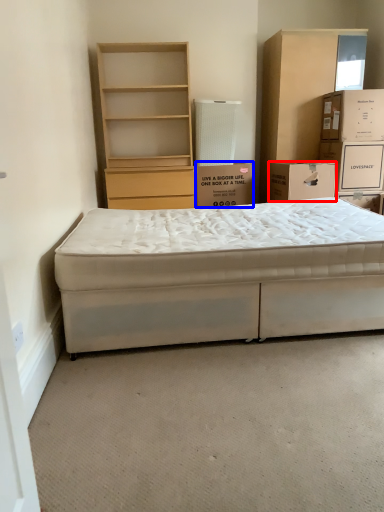
Question: Among these objects, which one is farthest to the camera, box (highlighted by a red box) or box (highlighted by a blue box)?

Choices:
 (A) box
 (B) box

Answer: (B)